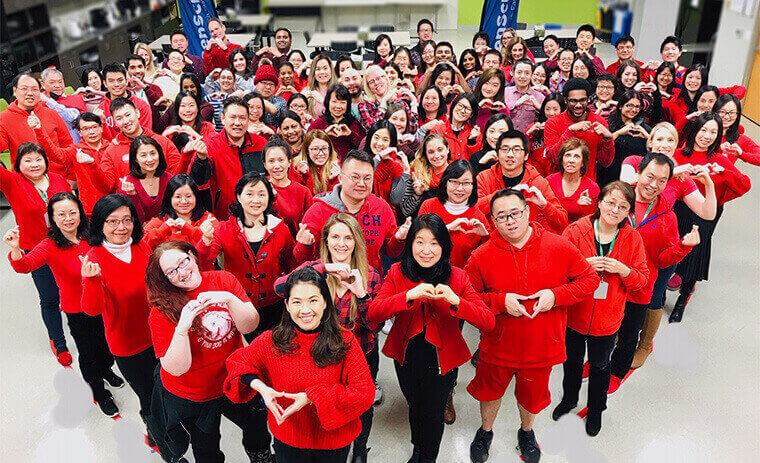
Identify the location of door to breakroom. (754, 91).